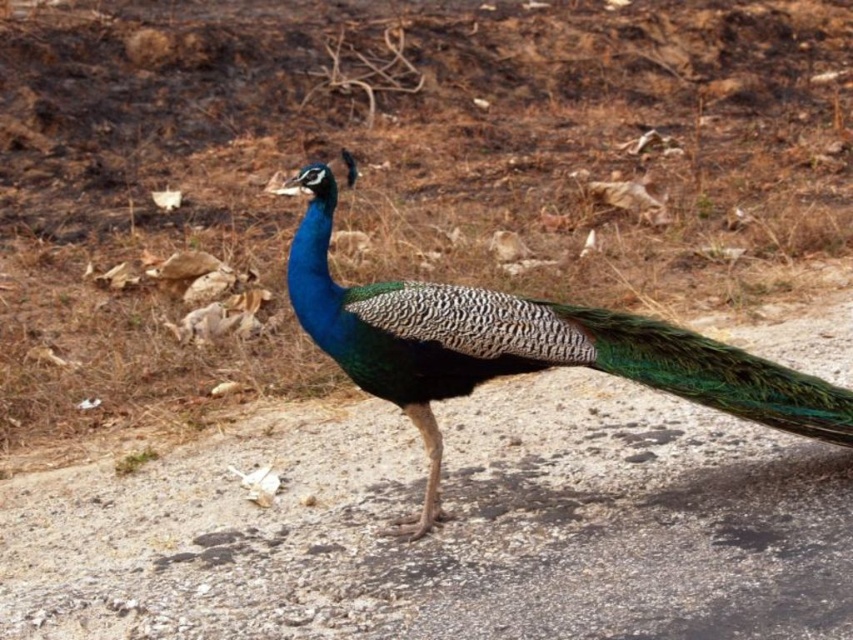
Between point (763, 368) and point (791, 374), which one is positioned in front?

Point (763, 368)

Does shiny blue peacock at center appear under green iridescent feathers at center?

Indeed, shiny blue peacock at center is positioned under green iridescent feathers at center.

Is point (315, 204) positioned behind point (759, 385)?

Yes, point (315, 204) is behind point (759, 385).

This screenshot has width=853, height=640. In order to click on shiny blue peacock at center in this screenshot , I will do `click(520, 348)`.